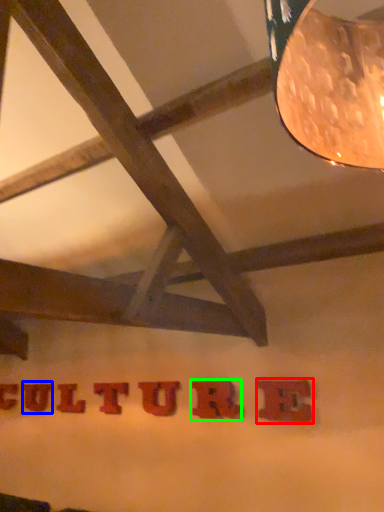
Question: Which is farther away from letter (highlighted by a red box)? letter (highlighted by a blue box) or letter (highlighted by a green box)?

Choices:
 (A) letter
 (B) letter

Answer: (A)